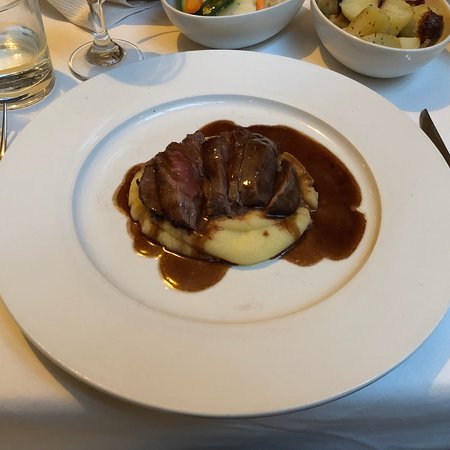
The image size is (450, 450). What are the coordinates of `plate` in the screenshot? It's located at (89, 185).